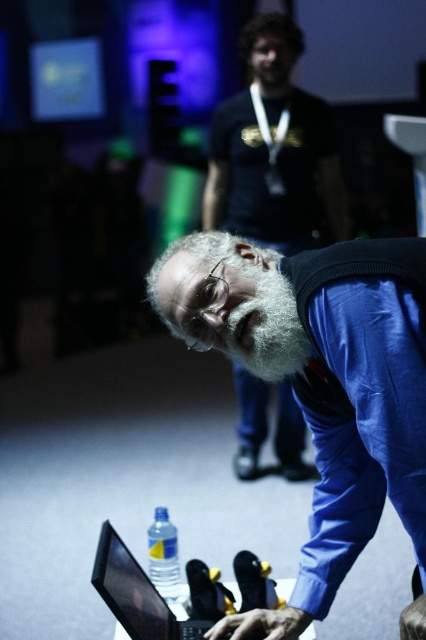
Question: Which point is farther from the camera taking this photo?

Choices:
 (A) (273, 97)
 (B) (154, 525)
 (C) (141, 579)
 (D) (331, 256)

Answer: (A)

Question: Which of the following is the closest to the observer?

Choices:
 (A) graywoollybeard at center
 (B) gray beard at center
 (C) blue fabric sweater at center
 (D) clear plastic bottle at lower center

Answer: (C)

Question: Considering the real-world distances, which object is farthest from the clear plastic bottle at lower center?

Choices:
 (A) gray beard at center
 (B) graywoollybeard at center

Answer: (A)

Question: Is gray beard at center to the left of clear plastic bottle at lower center from the viewer's perspective?

Choices:
 (A) yes
 (B) no

Answer: (B)

Question: Is blue fabric sweater at center to the right of gray beard at center from the viewer's perspective?

Choices:
 (A) yes
 (B) no

Answer: (A)

Question: Can you confirm if gray beard at center is bigger than graywoollybeard at center?

Choices:
 (A) yes
 (B) no

Answer: (A)